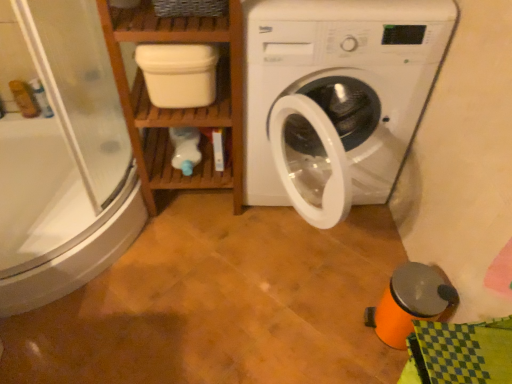
Question: From the image's perspective, is wooden shelf at left above or below white matte container at upper center?

Choices:
 (A) below
 (B) above

Answer: (A)

Question: Is wooden shelf at left taller or shorter than white matte container at upper center?

Choices:
 (A) short
 (B) tall

Answer: (B)

Question: Based on their relative distances, which object is farther from the white matte container at upper center?

Choices:
 (A) wooden shelf at left
 (B) white plastic washing machine at center
 (C) transparent glass shower door at left

Answer: (C)

Question: Estimate the real-world distances between objects in this image. Which object is closer to the wooden shelf at left?

Choices:
 (A) transparent glass shower door at left
 (B) white matte container at upper center
 (C) white plastic washing machine at center

Answer: (B)